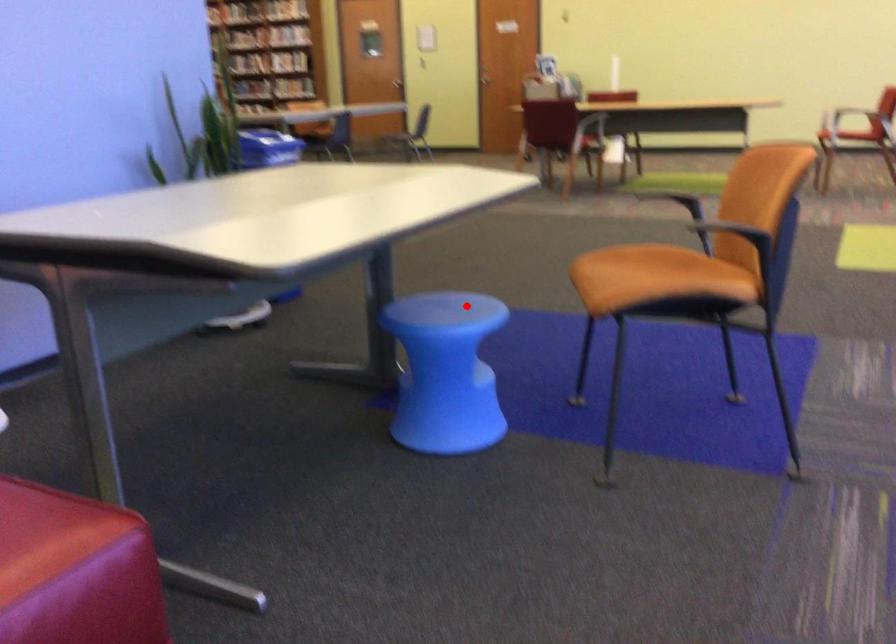
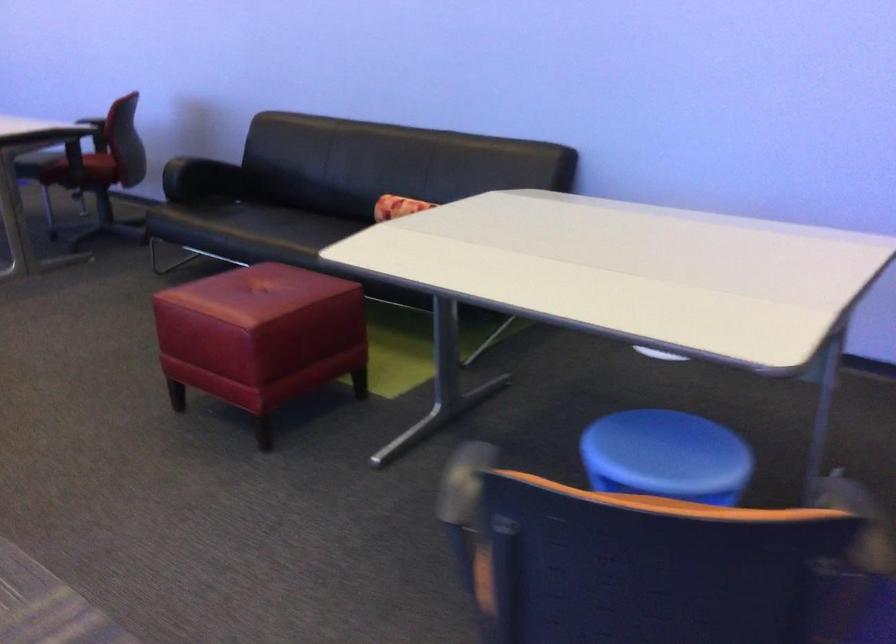
Locate, in the second image, the point that corresponds to the highlighted location in the first image.

(666, 456)